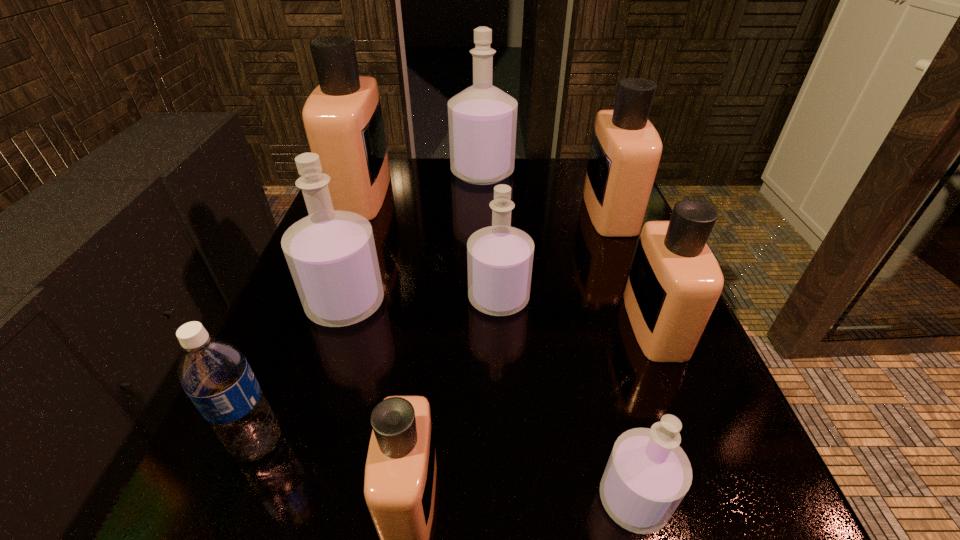
Locate an element on the screen. vacant space located 0.190m on the front label of the leftmost beige perfume is located at coordinates (461, 194).

Locate an element on the screen. This screenshot has height=540, width=960. vacant space situated on the front label of the third smallest beige perfume is located at coordinates (541, 212).

In order to click on free space located on the front label of the third smallest beige perfume in this screenshot , I will do `click(525, 212)`.

Locate an element on the screen. The height and width of the screenshot is (540, 960). vacant space located 0.150m on the front label of the third smallest beige perfume is located at coordinates (525, 212).

At what (x,y) coordinates should I click in order to perform the action: click on free space located on the front of the leftmost purple perfume. Please return your answer as a coordinate pair (x, y). Image resolution: width=960 pixels, height=540 pixels. Looking at the image, I should click on (318, 390).

Locate an element on the screen. vacant region located on the left of the third biggest purple perfume is located at coordinates (384, 298).

Where is `free location located 0.080m on the front label of the second nearest beige perfume`? free location located 0.080m on the front label of the second nearest beige perfume is located at coordinates (586, 325).

Identify the location of vacant space situated on the front label of the second nearest beige perfume. (513, 325).

In order to click on vacant space situated 0.110m on the front label of the second nearest beige perfume in this screenshot , I will do `click(568, 325)`.

Where is `vacant space located on the right of the water bottle`? vacant space located on the right of the water bottle is located at coordinates (504, 443).